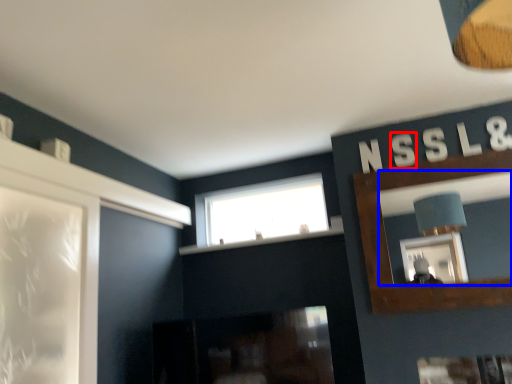
Question: Which object appears closest to the camera in this image, letter (highlighted by a red box) or mirror (highlighted by a blue box)?

Choices:
 (A) letter
 (B) mirror

Answer: (B)